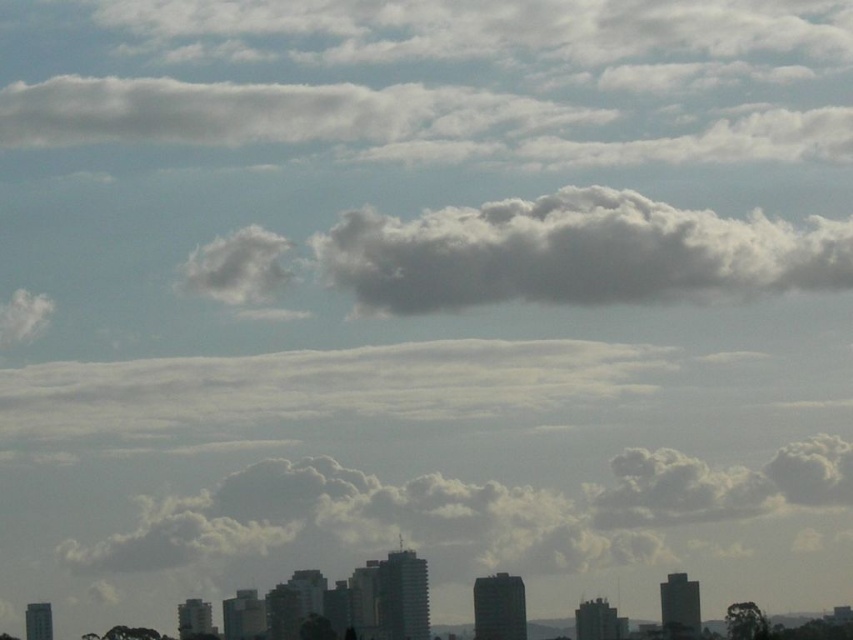
You are an architect designing a new skyscraper that will be 500 meters tall. The city requires that no part of the building can block sunlight to the area below the white fluffy cloud at upper center. Given the cloud is at point 0.177, 0.312 in the image, what is the maximum height your building can reach without violating the sunlight regulation?

The white fluffy cloud at upper center is positioned at point (265, 113). To ensure sunlight reaches the area below the cloud, the building must not exceed the height corresponding to this point. The maximum height the building can reach is 500 meters, but since the cloud is at 0.312 on the vertical axis, the building must be shorter than the cloud position. Therefore, the maximum height is 0.312 times the cloud height, but without specific scaling, it cannot be calculated precisely. However, the building

You are a drone operator who needs to fly a drone between the white fluffy cloud at center and the white fluffy cloud at upper center. The drone has a maximum flight range of 40 meters. Can the drone safely fly between them without running out of battery?

The white fluffy cloud at center and white fluffy cloud at upper center are 38.99 meters apart. Since the drone has a maximum flight range of 40 meters, it can safely fly between them as the distance is within the drone operator.